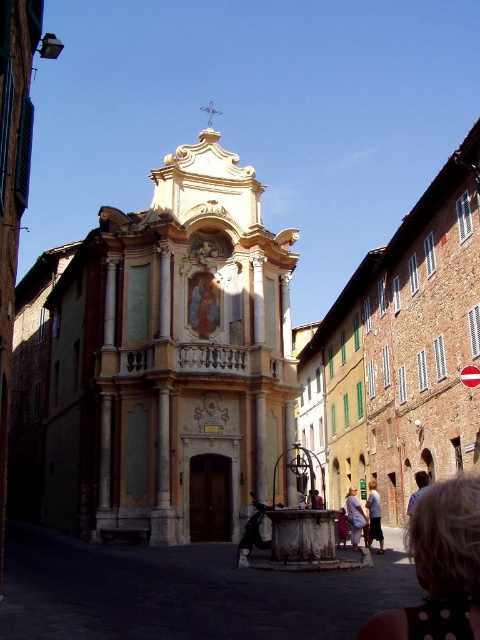
Between white cotton shirt at center and light brown leather shoe at center, which one appears on the left side from the viewer's perspective?

light brown leather shoe at center

Which is below, white cotton shirt at center or light brown leather shoe at center?

Positioned lower is white cotton shirt at center.

Does point (374, 531) come closer to viewer compared to point (342, 524)?

Yes.

The width and height of the screenshot is (480, 640). Identify the location of white cotton shirt at center. (374, 516).

Can you confirm if light yellow stone church at center is taller than light brown hair at center?

Indeed, light yellow stone church at center has a greater height compared to light brown hair at center.

Can you confirm if light yellow stone church at center is positioned below light brown hair at center?

Incorrect, light yellow stone church at center is not positioned below light brown hair at center.

Is point (72, 324) closer to camera compared to point (348, 518)?

No, (72, 324) is further to viewer.

You are a GUI agent. You are given a task and a screenshot of the screen. Output one action in this format:
    pyautogui.click(x=<x>, y=<y>)
    Task: Click on the light yellow stone church at center
    This screenshot has height=640, width=480.
    Given the screenshot: What is the action you would take?
    pyautogui.click(x=159, y=364)

Is light yellow stone church at center above white cotton shirt at center?

Indeed, light yellow stone church at center is positioned over white cotton shirt at center.

Between light yellow stone church at center and white cotton shirt at center, which one has more height?

Standing taller between the two is light yellow stone church at center.

Identify the location of light yellow stone church at center. The width and height of the screenshot is (480, 640). (159, 364).